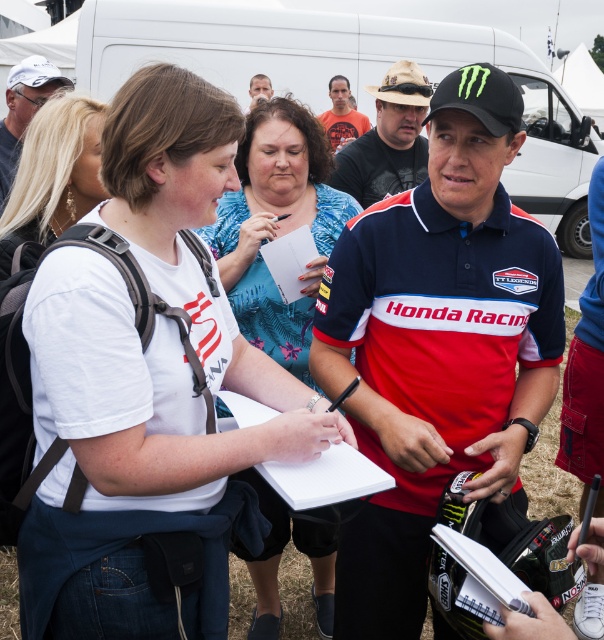
Question: Considering the relative positions of white cotton t-shirt at center and matte black helmet at upper center in the image provided, where is white cotton t-shirt at center located with respect to matte black helmet at upper center?

Choices:
 (A) below
 (B) above

Answer: (A)

Question: Is red fabric shirt at center to the right of white paper clipboard at center from the viewer's perspective?

Choices:
 (A) yes
 (B) no

Answer: (A)

Question: Which point is closer to the camera?

Choices:
 (A) (344, 102)
 (B) (1, 140)
 (C) (472, 564)
 (D) (248, 106)

Answer: (C)

Question: Which point appears farthest from the camera in this image?

Choices:
 (A) (268, 620)
 (B) (47, 68)
 (C) (205, 445)
 (D) (323, 113)

Answer: (D)

Question: Is black cotton shirt at center to the left of white paper clipboard at center from the viewer's perspective?

Choices:
 (A) yes
 (B) no

Answer: (B)

Question: Which point is closer to the camera?

Choices:
 (A) matte black helmet at upper center
 (B) white paper clipboard at center
 (C) white cotton t-shirt at center
 (D) red fabric shirt at center

Answer: (B)